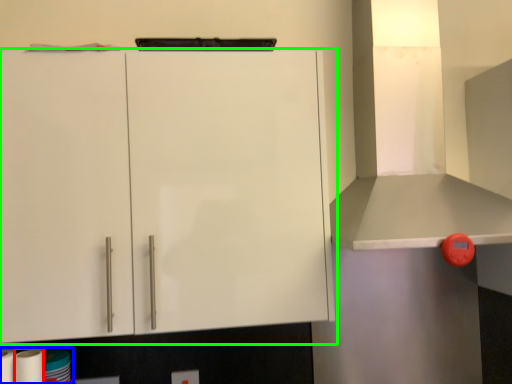
Question: Which is farther away from paper towel (highlighted by a red box)? toilet paper (highlighted by a blue box) or cabinetry (highlighted by a green box)?

Choices:
 (A) toilet paper
 (B) cabinetry

Answer: (B)